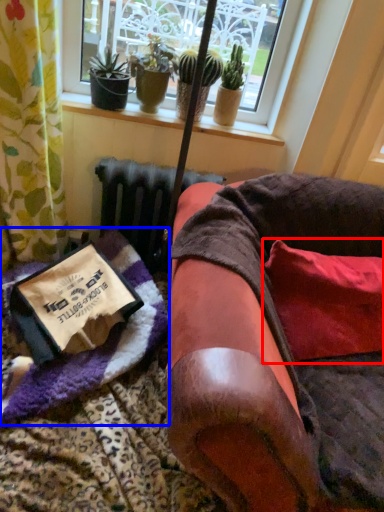
Question: Which object appears closest to the camera in this image, pillow (highlighted by a red box) or blanket (highlighted by a blue box)?

Choices:
 (A) pillow
 (B) blanket

Answer: (B)